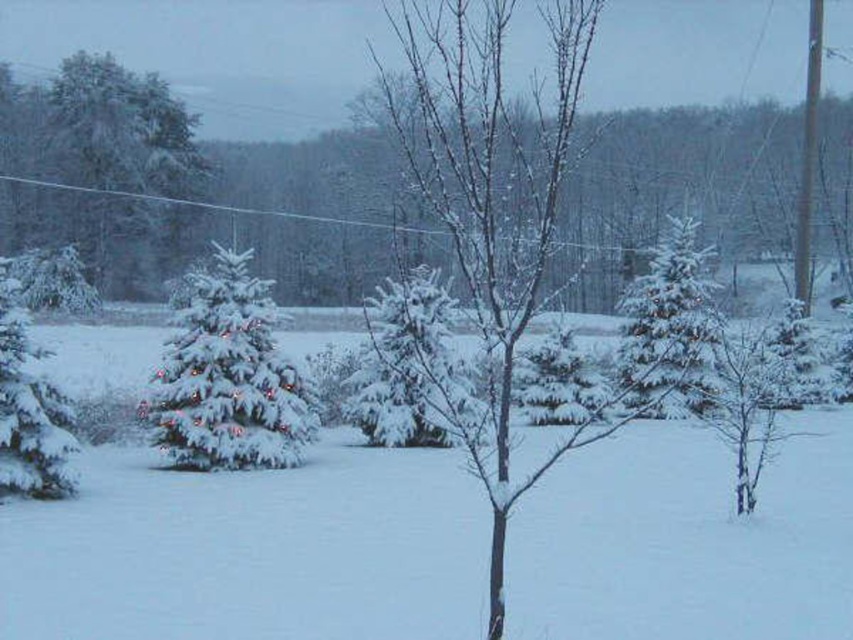
Question: Is green matte evergreen at upper left to the right of white frosty pine at center from the viewer's perspective?

Choices:
 (A) yes
 (B) no

Answer: (B)

Question: Based on their relative distances, which object is farther from the green frosted pine tree at left?

Choices:
 (A) green matte evergreen at upper left
 (B) snow-covered tree at center
 (C) smooth bark tree at right

Answer: (B)

Question: Which object appears closest to the camera in this image?

Choices:
 (A) green matte evergreen at left
 (B) green frosted pine tree at left

Answer: (A)

Question: Does snow-covered tree at center appear on the left side of smooth bark tree at right?

Choices:
 (A) yes
 (B) no

Answer: (A)

Question: Estimate the real-world distances between objects in this image. Which object is farther from the white snow-covered tree at center?

Choices:
 (A) green matte evergreen at upper left
 (B) smooth bark tree at right
 (C) white frosty pine at center
 (D) green frosted pine tree at left

Answer: (A)

Question: Does white frosty pine at center have a lesser width compared to smooth bark tree at right?

Choices:
 (A) yes
 (B) no

Answer: (B)